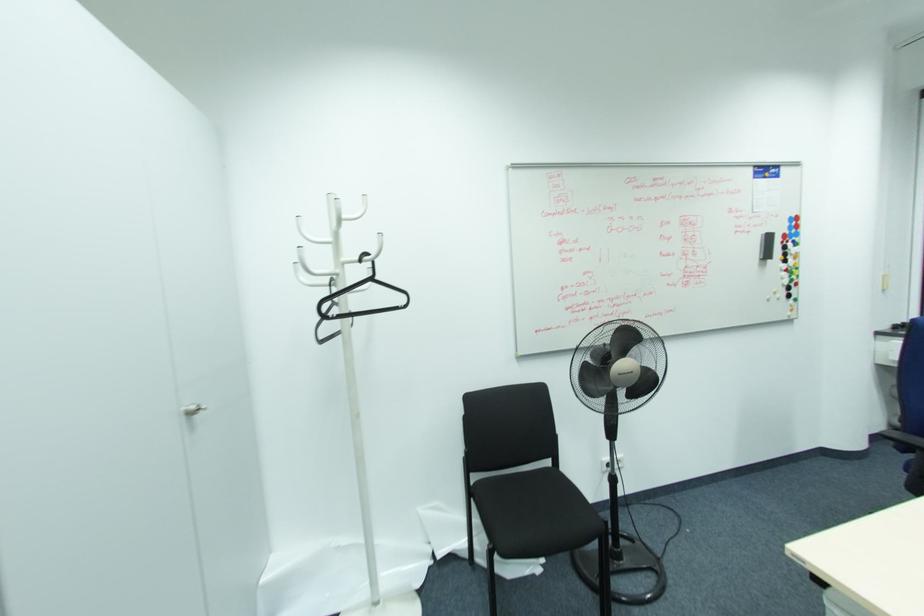
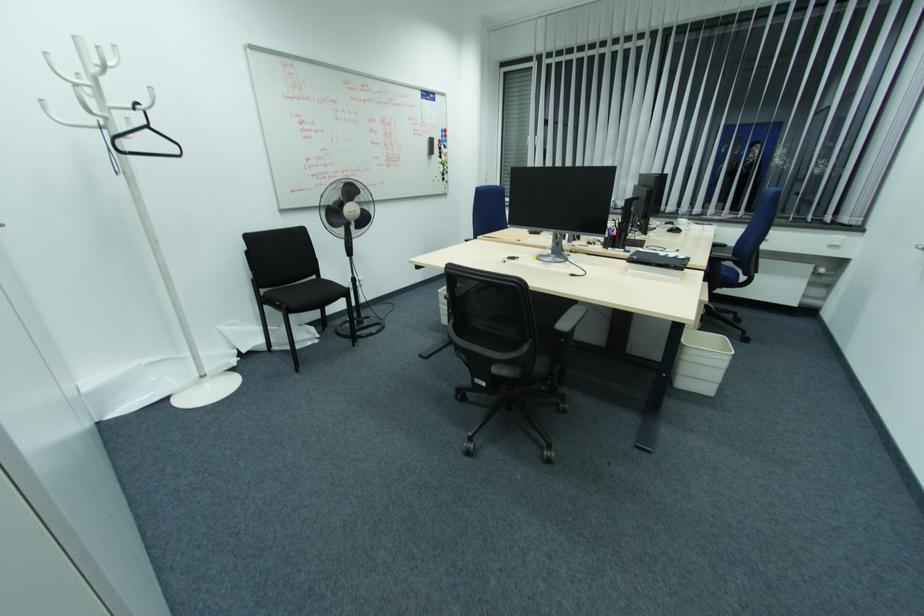
Find the pixel in the second image that matches (x=475, y=477) in the first image.

(262, 291)